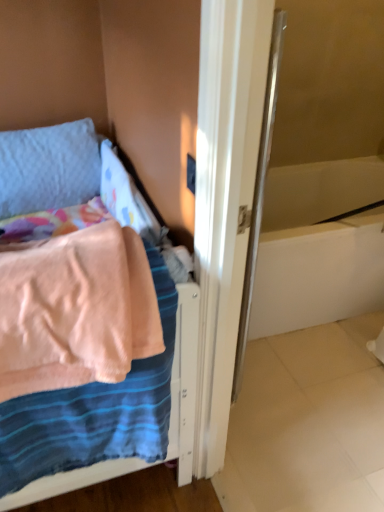
Question: Is point (81, 266) positioned closer to the camera than point (9, 216)?

Choices:
 (A) farther
 (B) closer

Answer: (B)

Question: Considering the positions of pink fabric bed at left and textured blue pillow at upper left in the image, is pink fabric bed at left taller or shorter than textured blue pillow at upper left?

Choices:
 (A) tall
 (B) short

Answer: (A)

Question: Which of these objects is positioned closest to the white glossy bathtub at center right?

Choices:
 (A) textured blue pillow at upper left
 (B) pink fabric bed at left

Answer: (B)

Question: Estimate the real-world distances between objects in this image. Which object is closer to the white glossy bathtub at center right?

Choices:
 (A) pink fabric bed at left
 (B) textured blue pillow at upper left

Answer: (A)